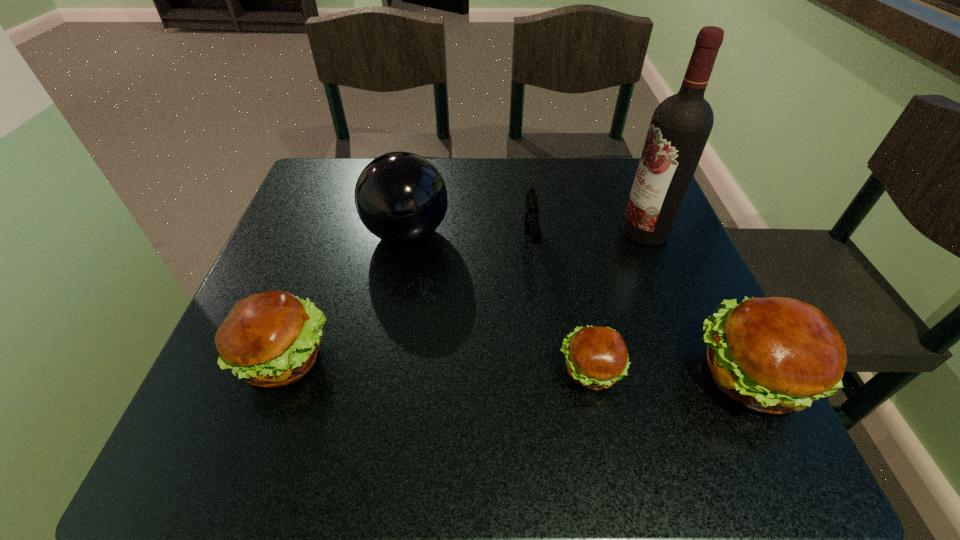
Please determine a free point for an extra hamburger to ensure balance. Please provide its 2D coordinates. Your answer should be formatted as a tuple, i.e. [(x, y)], where the tuple contains the x and y coordinates of a point satisfying the conditions above.

[(436, 364)]